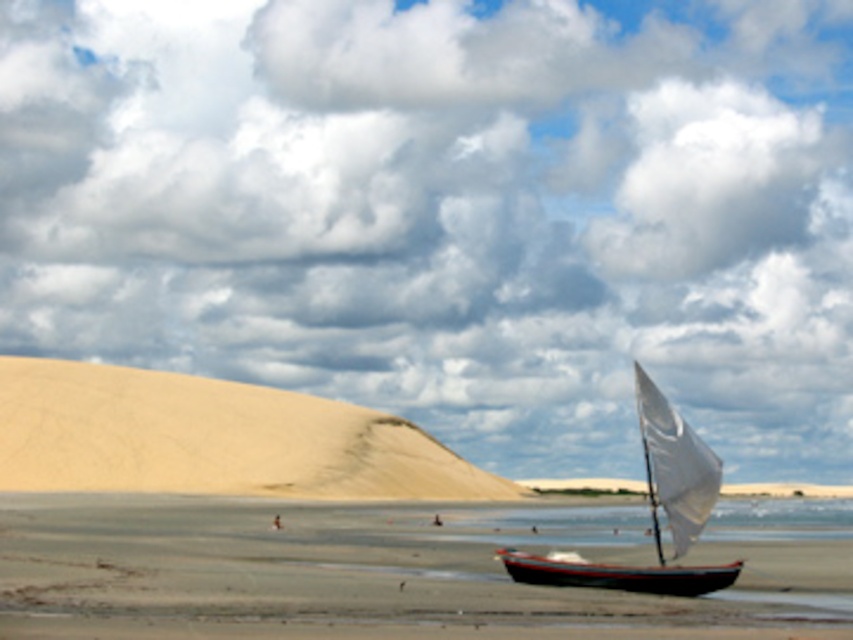
You are standing on the sandy beach and looking towards the cloudy sky at upper center. Which direction should you face to ensure the large, undulating sand dune is to your left and the small, traditional sailboat is directly in front of you?

You should face north. Facing north ensures the large, undulating sand dune is to your left and the small, traditional sailboat is directly in front of you.

You are standing on the beach and see two points marked on the sand. The first is at point [187,602], and the second is at point [575,577]. Which point is closer to you?

Point [187,602] is in front of point [575,577], so it is closer to you.